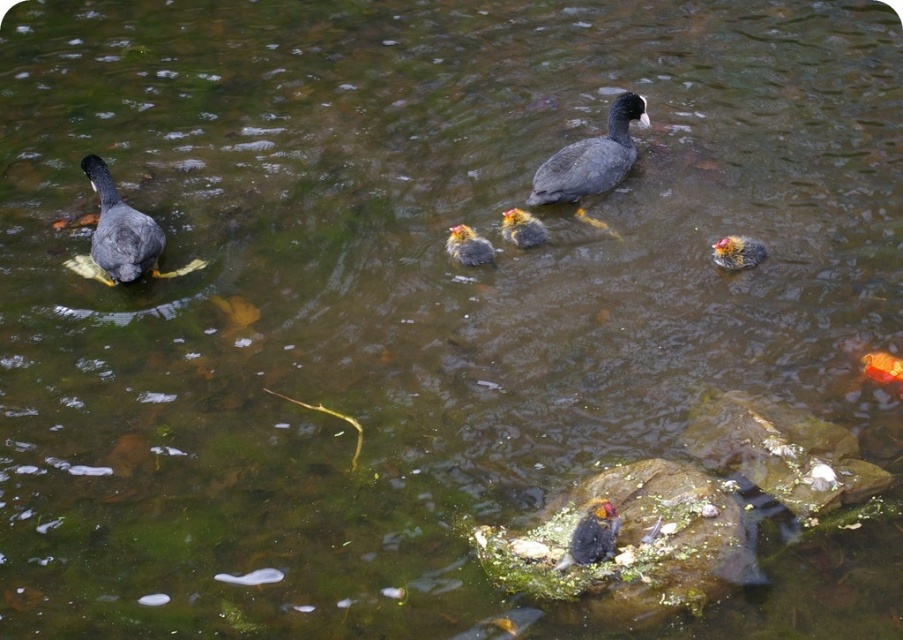
You are a wildlife photographer aiming to capture a closeup shot of the dark gray feathers at center. Your camera has a maximum zoom range of 10 feet. Can you get a clear closeup without moving closer physically?

The dark gray feathers at center is 12.70 feet away from camera. Since the camera can only zoom up to 10 feet, you cannot get a clear closeup without moving closer physically.

You are standing at the edge of the water and see the yellow down feathers duckling at center. If you want to take a photo of it with your camera, which has a maximum focus range of 5 meters, will you be able to capture it clearly?

The yellow down feathers duckling at center is 5.89 meters away from the camera. Since the camera can only focus up to 5 meters, you won t be able to capture the duckling clearly.